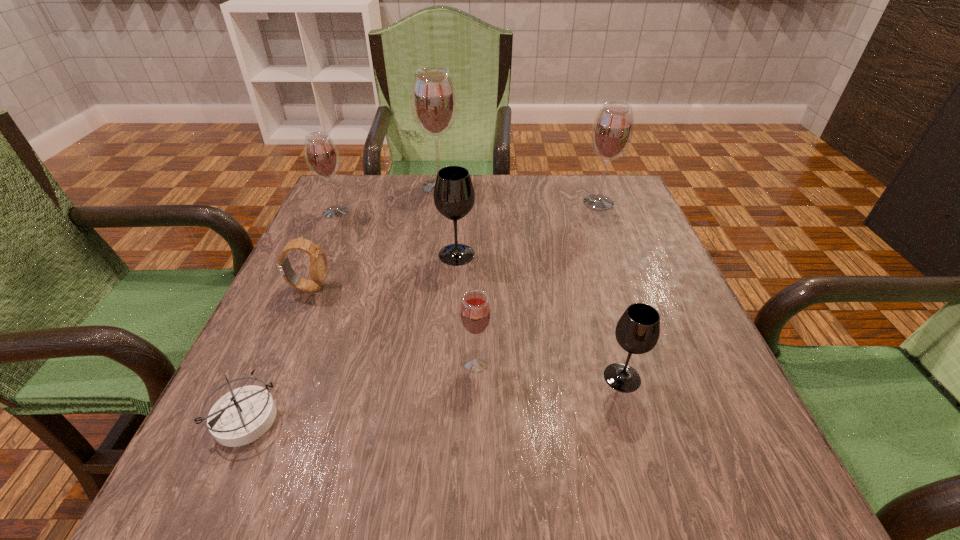
In order to click on the smaller gray wineglass in this screenshot , I will do `click(637, 331)`.

This screenshot has width=960, height=540. What are the coordinates of `the nearer gray wineglass` in the screenshot? It's located at point(637,331).

Where is `the fourth nearest object`? the fourth nearest object is located at coordinates (318, 265).

At what (x,y) coordinates should I click in order to perform the action: click on watch. Please return your answer as a coordinate pair (x, y). Image resolution: width=960 pixels, height=540 pixels. Looking at the image, I should click on (318, 265).

Where is `the shortest object`? This screenshot has width=960, height=540. the shortest object is located at coordinates (243, 415).

Where is `vacant space located 0.100m on the front of the third red wineglass from right to left`? The height and width of the screenshot is (540, 960). vacant space located 0.100m on the front of the third red wineglass from right to left is located at coordinates (435, 218).

What are the coordinates of `free space located 0.050m on the right of the fifth shortest wineglass` in the screenshot? It's located at pos(636,202).

At what (x,y) coordinates should I click in order to perform the action: click on blank space located 0.240m on the right of the leftmost red wineglass. Please return your answer as a coordinate pair (x, y). Looking at the image, I should click on (444, 212).

Locate an element on the screen. The width and height of the screenshot is (960, 540). vacant position located on the right of the farther gray wineglass is located at coordinates (545, 254).

Where is `vacant area located on the left of the nearest red wineglass`? vacant area located on the left of the nearest red wineglass is located at coordinates (391, 361).